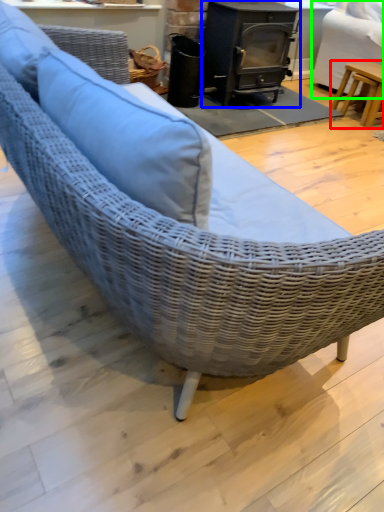
Question: Considering the real-world distances, which object is closest to table (highlighted by a red box)? wood burning stove (highlighted by a blue box) or swivel chair (highlighted by a green box).

Choices:
 (A) wood burning stove
 (B) swivel chair

Answer: (B)